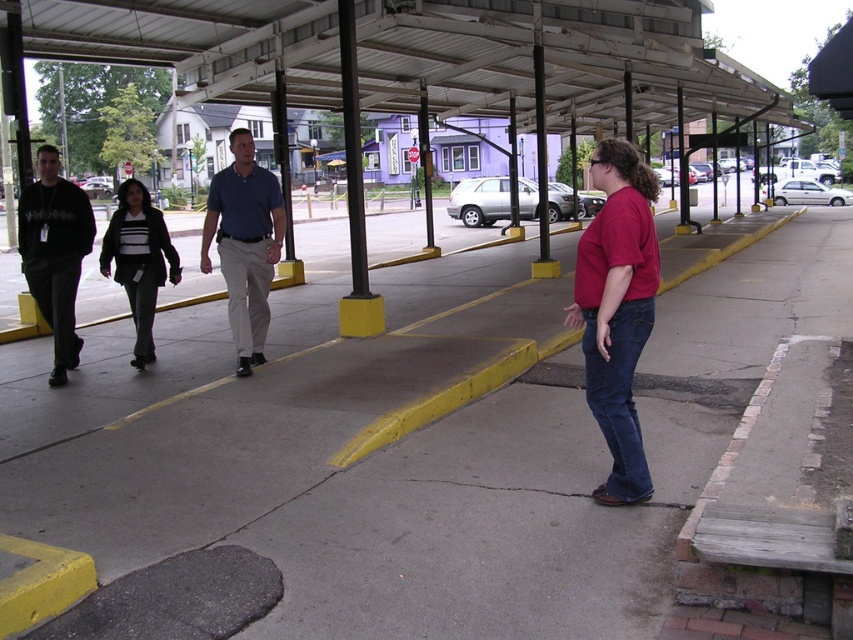
Question: Which of the following is the farthest from the observer?

Choices:
 (A) (631, 452)
 (B) (413, 419)
 (C) (120, 582)
 (D) (252, 253)

Answer: (D)

Question: Can you confirm if yellow painted curb at center is wider than matte black sweater at center?

Choices:
 (A) yes
 (B) no

Answer: (A)

Question: Among these points, which one is nearest to the camera?

Choices:
 (A) (634, 310)
 (B) (247, 344)
 (C) (137, 200)
 (D) (22, 262)

Answer: (A)

Question: Is gray concrete pavement at center wider than matte black shirt at left?

Choices:
 (A) no
 (B) yes

Answer: (B)

Question: Which object appears closest to the camera in this image?

Choices:
 (A) matte black shirt at left
 (B) gray concrete pavement at center

Answer: (B)

Question: Is blue cotton shirt at center smaller than yellow painted curb at center?

Choices:
 (A) no
 (B) yes

Answer: (B)